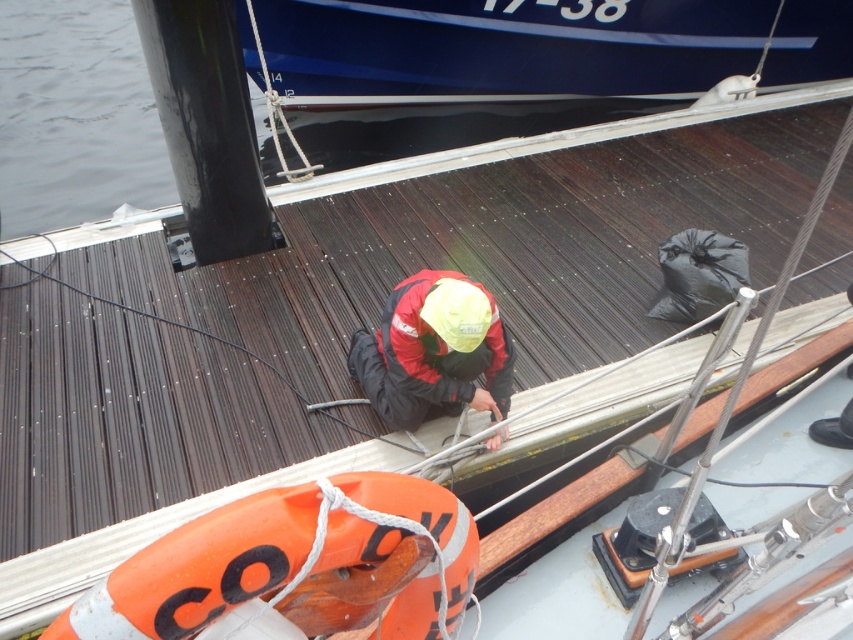
You are standing on the dock and see two points marked on the wooden deck. Which point is closer to you, point [380,484] or point [440,316]?

Point [380,484] is closer to the viewer than point [440,316].

You are a safety inspector on the dock and need to ensure all safety equipment is properly positioned. According to the image, is the orange plastic life jacket at lower center located in a safe position relative to the red matte jacket at center?

The orange plastic life jacket at lower center is in front of the red matte jacket at center, which means it is positioned closer to the edge of the dock. This placement ensures quick access for safety purposes, so it is in a safe position.